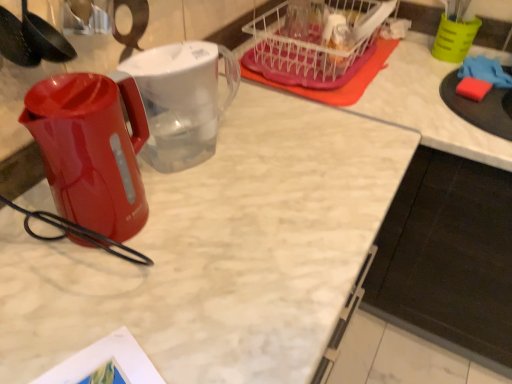
Question: Considering the relative sizes of translucent plastic basket at upper right and glossy plastic kettle at left in the image provided, is translucent plastic basket at upper right shorter than glossy plastic kettle at left?

Choices:
 (A) no
 (B) yes

Answer: (B)

Question: From the image's perspective, is translucent plastic basket at upper right below glossy plastic kettle at left?

Choices:
 (A) no
 (B) yes

Answer: (A)

Question: From the image's perspective, is translucent plastic basket at upper right on glossy plastic kettle at left?

Choices:
 (A) yes
 (B) no

Answer: (A)

Question: Is glossy plastic kettle at left completely or partially inside translucent plastic basket at upper right?

Choices:
 (A) no
 (B) yes

Answer: (A)

Question: Are translucent plastic basket at upper right and glossy plastic kettle at left beside each other?

Choices:
 (A) yes
 (B) no

Answer: (B)

Question: Considering the relative sizes of translucent plastic basket at upper right and glossy plastic kettle at left in the image provided, is translucent plastic basket at upper right bigger than glossy plastic kettle at left?

Choices:
 (A) no
 (B) yes

Answer: (B)

Question: Is green plastic cup at upper right positioned behind glossy plastic kettle at left?

Choices:
 (A) yes
 (B) no

Answer: (A)

Question: Does green plastic cup at upper right have a larger size compared to glossy plastic kettle at left?

Choices:
 (A) no
 (B) yes

Answer: (A)

Question: Is green plastic cup at upper right closer to the viewer compared to glossy plastic kettle at left?

Choices:
 (A) no
 (B) yes

Answer: (A)

Question: From the image's perspective, is green plastic cup at upper right on top of glossy plastic kettle at left?

Choices:
 (A) no
 (B) yes

Answer: (B)

Question: Considering the relative sizes of green plastic cup at upper right and glossy plastic kettle at left in the image provided, is green plastic cup at upper right smaller than glossy plastic kettle at left?

Choices:
 (A) no
 (B) yes

Answer: (B)

Question: Is green plastic cup at upper right placed right next to glossy plastic kettle at left?

Choices:
 (A) yes
 (B) no

Answer: (B)

Question: Is black matte cabinet at lower right positioned beyond the bounds of glossy plastic kettle at left?

Choices:
 (A) yes
 (B) no

Answer: (A)